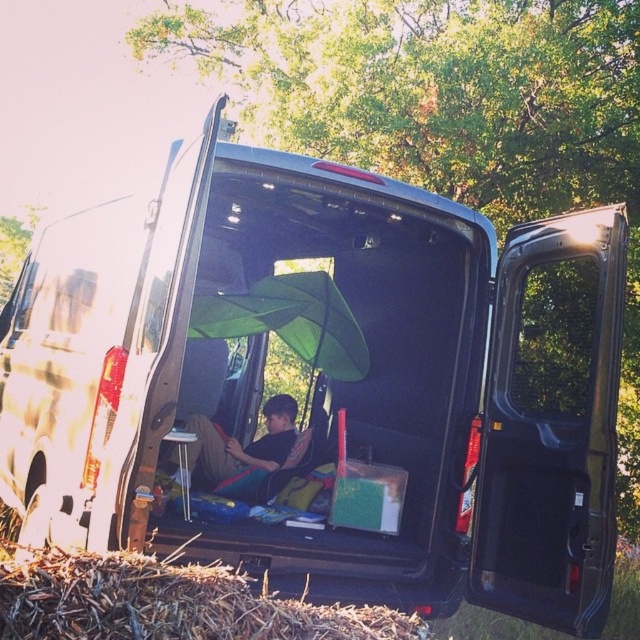
The width and height of the screenshot is (640, 640). What are the coordinates of `brown straw at lower left` in the screenshot? It's located at (168, 604).

Which is more to the right, brown straw at lower left or black fabric at center?

From the viewer's perspective, brown straw at lower left appears more on the right side.

Is point (100, 566) closer to viewer compared to point (285, 394)?

Yes, it is.

This screenshot has height=640, width=640. I want to click on brown straw at lower left, so click(168, 604).